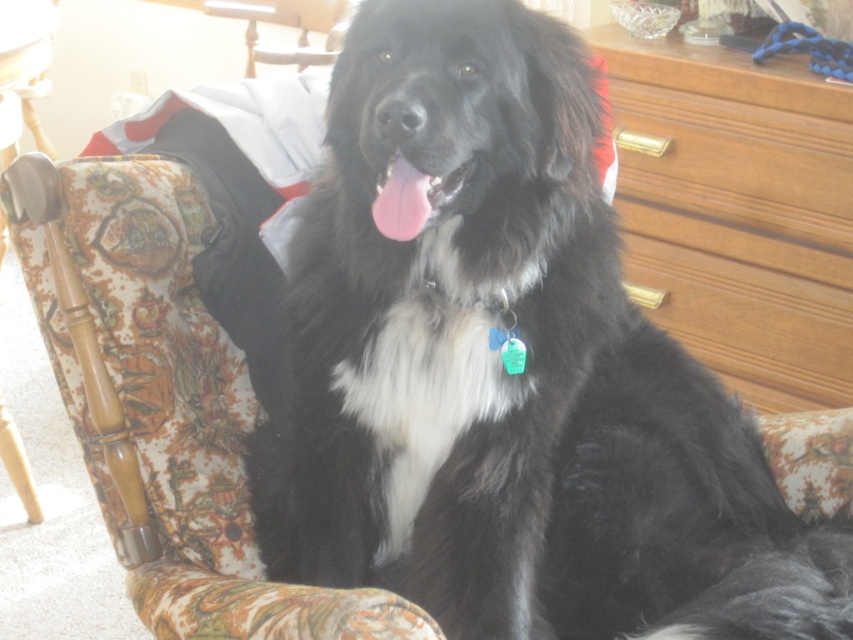
You are trying to decide if the black soft fur dog at center can fit through a doorway located near the wooden at upper right. Based on their sizes, can the dog pass through?

The black soft fur dog at center might be wider than wooden at upper right, so there is a possibility that the dog may not fit through the doorway if the wooden at upper right is blocking the path or if the doorway is narrower than the dog.